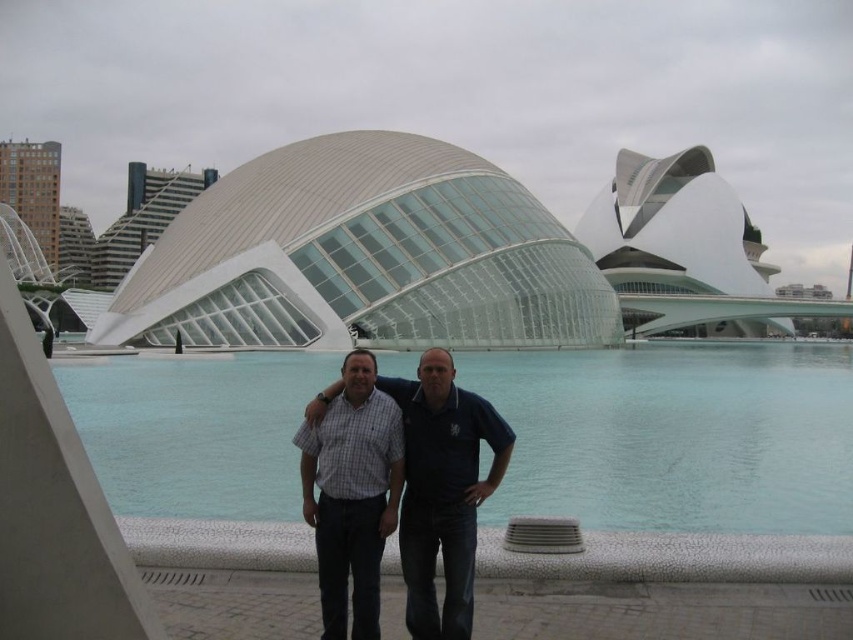
You are standing in front of the modern architectural structure in the City of Arts and Sciences. You see a person wearing a dark blue shirt at center. If you want to take a photo of them from the paved area, where should you position yourself relative to the low wall in front of them?

You should position yourself behind the low wall in front of them to capture the dark blue shirt at center in your photo since the wall is between you and the subject.

You are a photographer planning to capture a photo of the transparent glass water at center and the checkered fabric shirt at center. To ensure both are in focus, you need to know their relative positions. Which object is located to the right of the other?

The transparent glass water at center is positioned on the right side of checkered fabric shirt at center, so it is to the right of the shirt.

You are a photographer at the City of Arts and Sciences in Valencia, Spain. You need to capture a photo of two friends standing on a paved area with a low wall in front of them. The friends are wearing a dark blue shirt at center and a checkered fabric shirt at center. Based on their positions, which friend is standing to the right of the other?

The dark blue shirt at center is positioned on the right side of checkered fabric shirt at center, so the friend wearing the dark blue shirt at center is standing to the right of the one in the checkered fabric shirt at center.